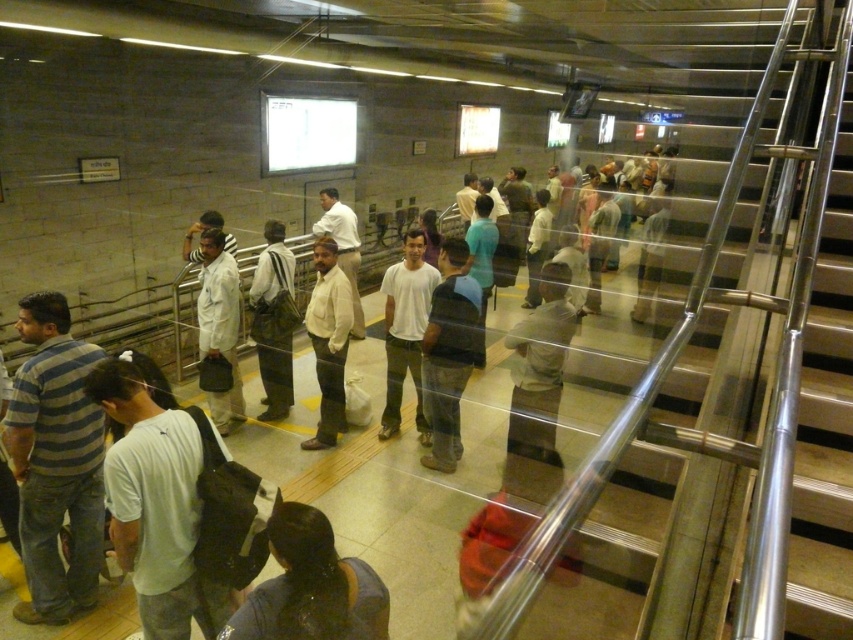
Which is above, white matte uniform at center or light brown shirt at center?

light brown shirt at center

Between point (230, 257) and point (339, 248), which one is positioned in front?

Point (230, 257) is more forward.

You are a GUI agent. You are given a task and a screenshot of the screen. Output one action in this format:
    pyautogui.click(x=<x>, y=<y>)
    Task: Click on the white matte uniform at center
    Image resolution: width=853 pixels, height=640 pixels.
    Given the screenshot: What is the action you would take?
    pyautogui.click(x=219, y=321)

Does light brown leather pants at center have a greater height compared to light brown shirt at center?

Correct, light brown leather pants at center is much taller as light brown shirt at center.

Does light brown leather pants at center come behind light brown shirt at center?

No, light brown leather pants at center is in front of light brown shirt at center.

At what (x,y) coordinates should I click in order to perform the action: click on light brown leather pants at center. Please return your answer as a coordinate pair (x, y). This screenshot has height=640, width=853. Looking at the image, I should click on (271, 269).

Is light gray shirt at center smaller than dark blue shirt at center?

Incorrect, light gray shirt at center is not smaller in size than dark blue shirt at center.

Does light gray shirt at center have a larger size compared to dark blue shirt at center?

Indeed, light gray shirt at center has a larger size compared to dark blue shirt at center.

Which is in front, point (543, 387) or point (428, 403)?

Point (543, 387)

Find the location of a particular element. The height and width of the screenshot is (640, 853). light gray shirt at center is located at coordinates (538, 388).